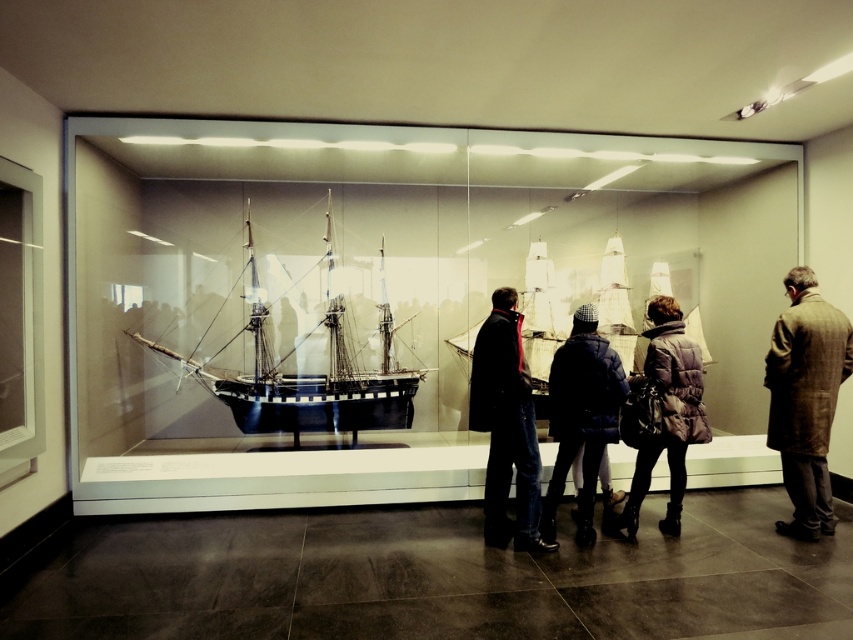
Is brown wool coat at right below dark blue quilted jacket at center?

Incorrect, brown wool coat at right is not positioned below dark blue quilted jacket at center.

Between point (798, 416) and point (590, 513), which one is positioned in front?

Point (798, 416) is more forward.

This screenshot has height=640, width=853. Find the location of `brown wool coat at right`. brown wool coat at right is located at coordinates (805, 397).

Who is taller, black polished wood ship at center or dark brown leather coat at center?

black polished wood ship at center

Does black polished wood ship at center have a greater width compared to dark brown leather coat at center?

Yes.

Does point (291, 412) come behind point (483, 512)?

Yes.

Find the location of a particular element. The image size is (853, 640). black polished wood ship at center is located at coordinates (306, 376).

Is brown wool coat at right bigger than dark brown leather coat at center?

No.

Which is behind, point (799, 417) or point (474, 412)?

Point (799, 417)

You are a GUI agent. You are given a task and a screenshot of the screen. Output one action in this format:
    pyautogui.click(x=<x>, y=<y>)
    Task: Click on the brown wool coat at right
    This screenshot has width=853, height=640.
    Given the screenshot: What is the action you would take?
    pyautogui.click(x=805, y=397)